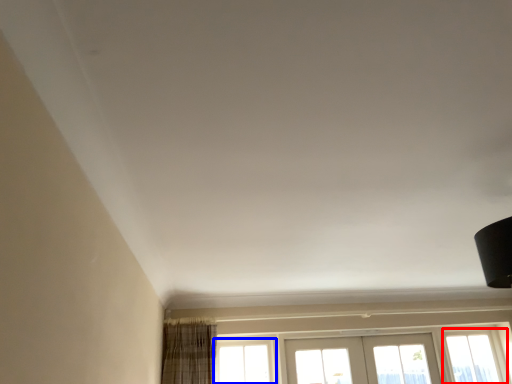
Question: Which of the following is the farthest to the observer, window (highlighted by a red box) or window (highlighted by a blue box)?

Choices:
 (A) window
 (B) window

Answer: (A)